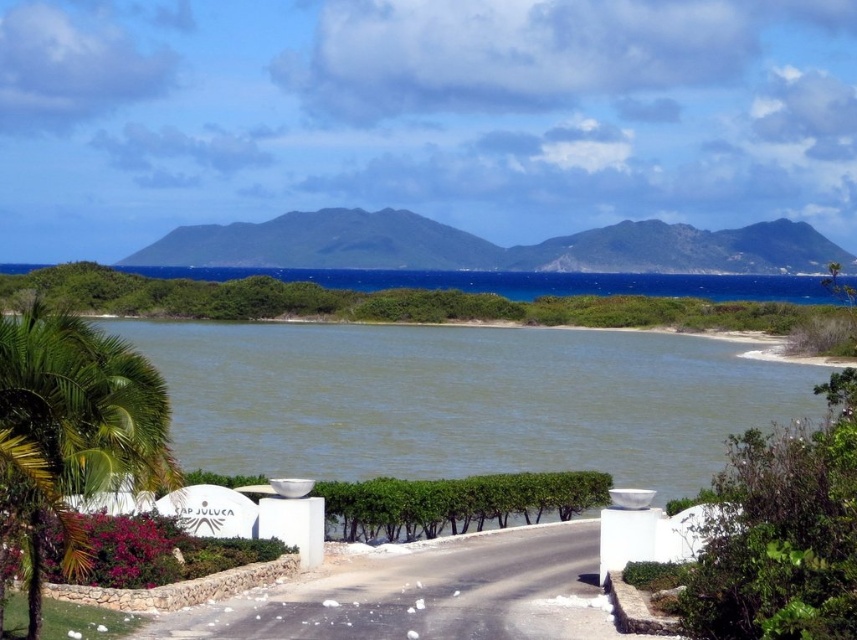
Question: Is green water at center bigger than green leafy palm tree at lower left?

Choices:
 (A) no
 (B) yes

Answer: (B)

Question: Which of the following is the farthest from the observer?

Choices:
 (A) (106, 428)
 (B) (220, 436)

Answer: (B)

Question: Which object is closer to the camera taking this photo?

Choices:
 (A) green water at center
 (B) green leafy palm tree at lower left

Answer: (B)

Question: From the image, what is the correct spatial relationship of green water at center in relation to green leafy palm tree at lower left?

Choices:
 (A) left
 (B) right

Answer: (B)

Question: Is green water at center above green leafy palm tree at lower left?

Choices:
 (A) yes
 (B) no

Answer: (A)